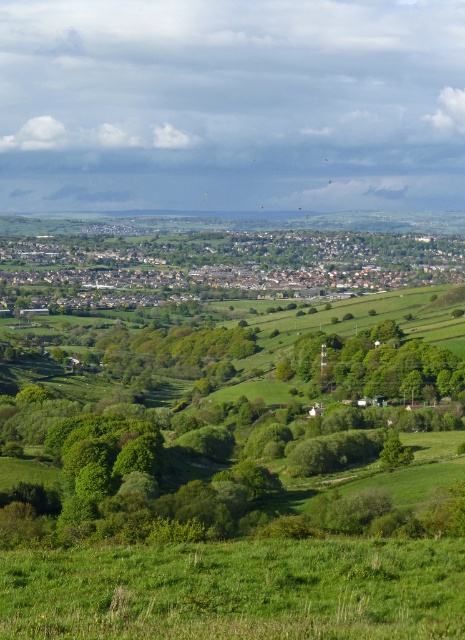
What is the 2D coordinate of the green grassy field at center in the image?

The green grassy field at center is located at the 2D coordinate point of (218,266).

You are standing in the middle of the green leafy trees at center and want to walk towards the green grassy field at lower center. In which direction should you go?

The green grassy field at lower center is to the right of green leafy trees at center, so you should walk towards the right to reach it.

You are a landscape architect designing a new park. You have to decide where to place a large statue. The statue requires a space that is larger than the green leafy trees at center. Based on the scene, can you place the statue in the green grassy field at center?

The green grassy field at center has a larger size compared to green leafy trees at center, so yes, the statue can be placed in the green grassy field at center as it provides sufficient space.